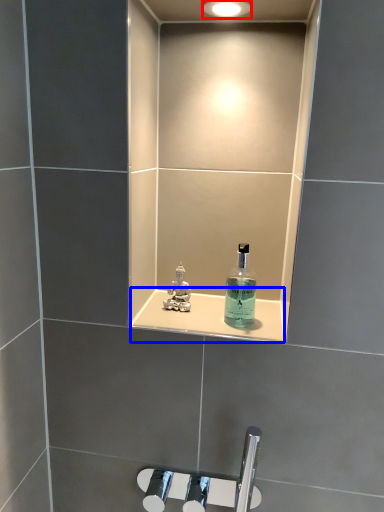
Question: Which of the following is the farthest to the observer, light fixture (highlighted by a red box) or ledge (highlighted by a blue box)?

Choices:
 (A) light fixture
 (B) ledge

Answer: (B)